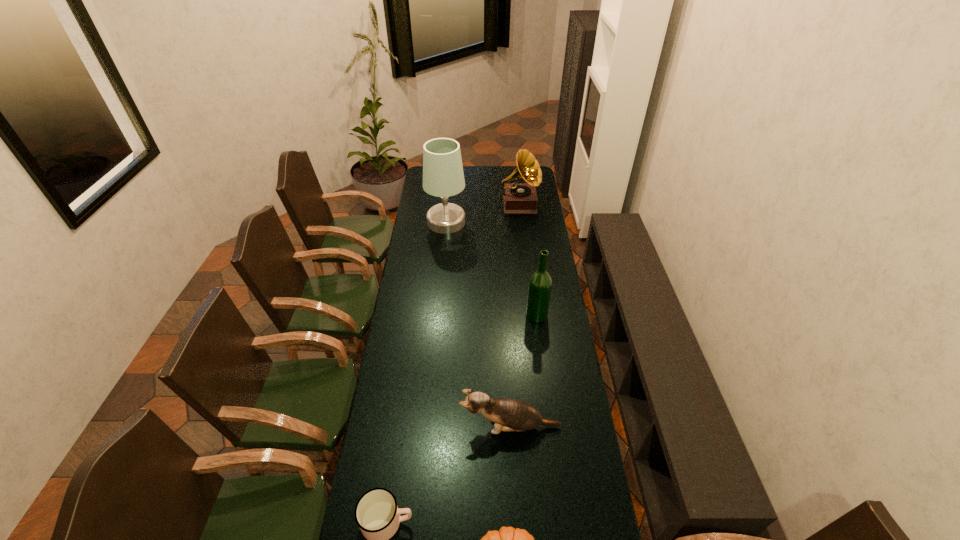
Identify the location of object at the left edge. (443, 176).

The height and width of the screenshot is (540, 960). In order to click on phonograph record that is at the right edge in this screenshot , I will do `click(518, 198)`.

Where is `alcohol that is at the right edge`? The width and height of the screenshot is (960, 540). alcohol that is at the right edge is located at coordinates (540, 283).

Locate an element on the screen. cat that is at the right edge is located at coordinates (515, 415).

The width and height of the screenshot is (960, 540). Find the location of `vacant space at the far edge of the desktop`. vacant space at the far edge of the desktop is located at coordinates (495, 174).

Where is `vacant space at the left edge of the desktop`? Image resolution: width=960 pixels, height=540 pixels. vacant space at the left edge of the desktop is located at coordinates (374, 456).

Identify the location of free point at the right edge. The height and width of the screenshot is (540, 960). (548, 271).

Locate an element on the screen. Image resolution: width=960 pixels, height=540 pixels. vacant space in between the third nearest object and the phonograph record is located at coordinates (515, 316).

You are a GUI agent. You are given a task and a screenshot of the screen. Output one action in this format:
    pyautogui.click(x=<x>, y=<y>)
    Task: Click on the vacant area that lies between the cat and the lampshade
    
    Given the screenshot: What is the action you would take?
    pyautogui.click(x=478, y=324)

I want to click on vacant region between the third nearest object and the tallest object, so click(x=478, y=324).